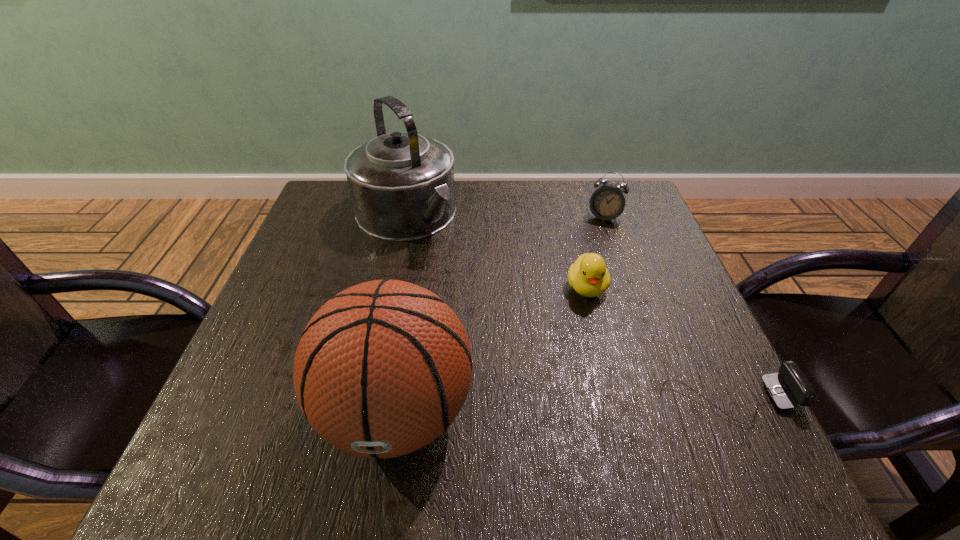
Where is `vacant spot on the desktop that is between the basketball and the webcam and is positioned with the spout at the front of the kettle`? Image resolution: width=960 pixels, height=540 pixels. vacant spot on the desktop that is between the basketball and the webcam and is positioned with the spout at the front of the kettle is located at coordinates (607, 404).

Image resolution: width=960 pixels, height=540 pixels. Identify the location of free spot on the desktop that is between the basketball and the webcam and is positioned on the face of the third tallest object. (544, 407).

Find the location of a particular element. vacant spot on the desktop that is between the basketball and the shortest object and is positioned on the beak of the third farthest object is located at coordinates (599, 404).